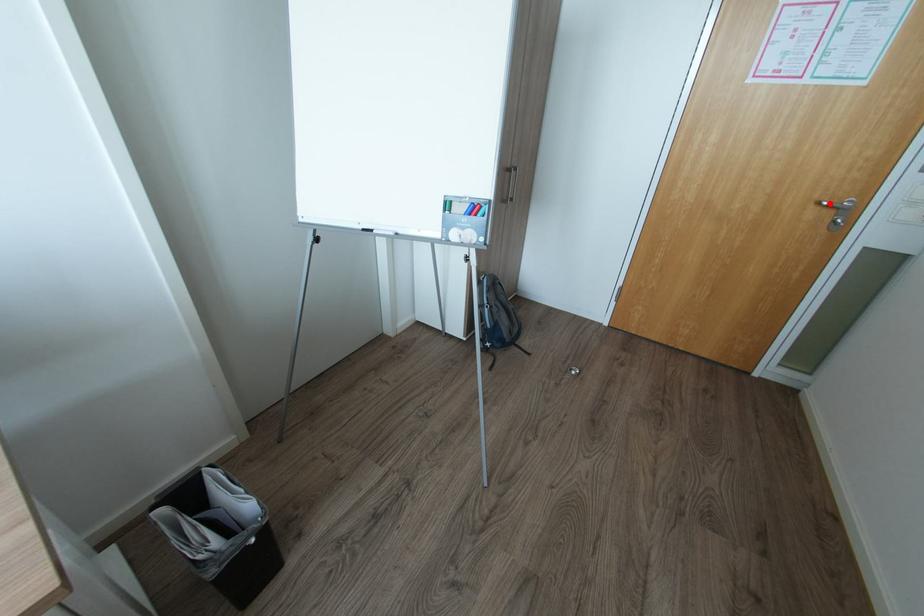
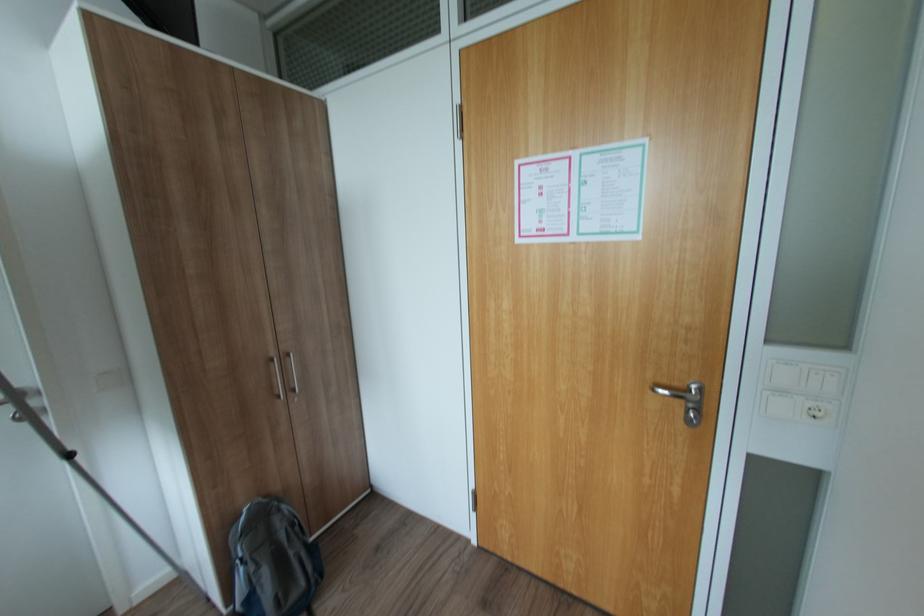
Question: I am providing you with two images of the same scene from different viewpoints. A red point is marked on the first image. Is the red point's position out of view in image 2?

Choices:
 (A) Yes
 (B) No

Answer: (B)